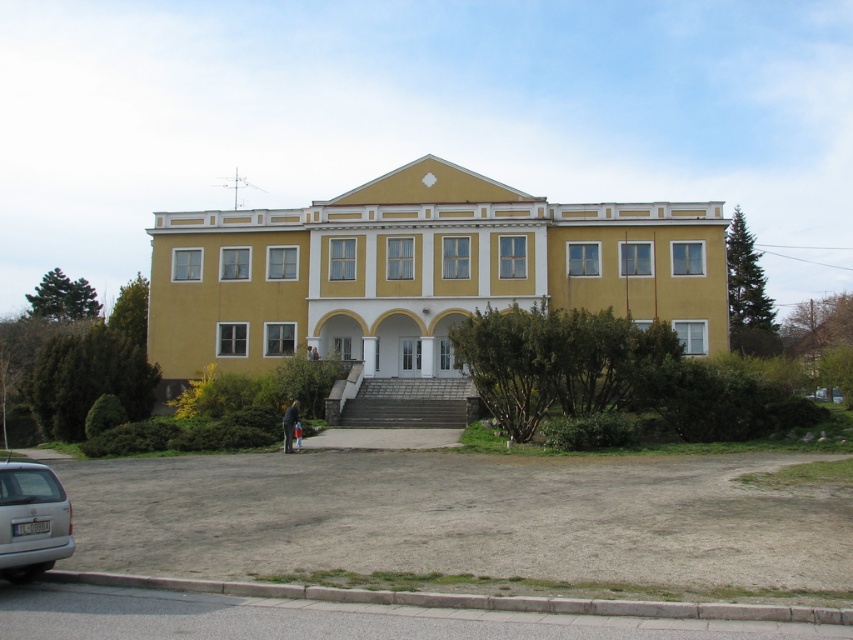
You are a delivery driver arriving at the yellow matte building at center. You need to park your silver metallic van at lower left near the entrance. Is the van currently positioned in a way that blocks the entrance?

The silver metallic van at lower left is behind the yellow matte building at center, so it is not blocking the entrance. You can proceed to park near the entrance without obstructing the entrance.

You are a photographer trying to capture the yellow matte building at center and the silver metallic van at lower left in a single frame. Based on their sizes, which object should you focus on to ensure both are clearly visible in the photo?

The yellow matte building at center has a larger size compared to the silver metallic van at lower left, so focusing on the yellow matte building at center will ensure both are clearly visible in the photo.